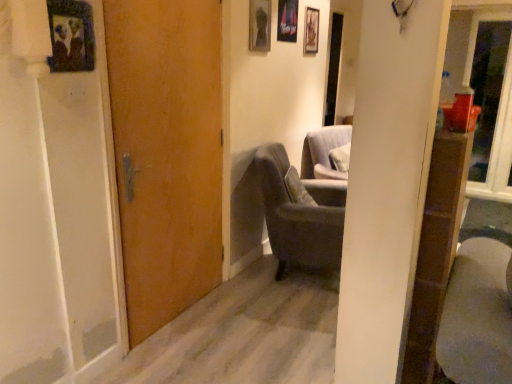
Measure the distance between metallic silver picture frame at upper center, marked as the second picture frame in a right-to-left arrangement, and camera.

The depth of metallic silver picture frame at upper center, marked as the second picture frame in a right-to-left arrangement, is 2.94 meters.

Identify the location of dark gray fabric chair at center. The width and height of the screenshot is (512, 384). (300, 215).

I want to click on transparent glass door at upper right, so click(x=490, y=107).

What is the approximate width of wooden picture frame at upper left, the 1th picture frame from the front?

1.01 inches.

What do you see at coordinates (71, 36) in the screenshot? This screenshot has width=512, height=384. I see `wooden picture frame at upper left, the first picture frame viewed from the left` at bounding box center [71, 36].

Locate an element on the screen. matte glass picture frame at upper center, placed as the 2th picture frame when sorted from front to back is located at coordinates (259, 25).

The height and width of the screenshot is (384, 512). What are the coordinates of `metallic silver picture frame at upper center, marked as the second picture frame in a right-to-left arrangement` in the screenshot? It's located at (287, 21).

In the scene shown: Is wooden picture frame at upper left, which is the 4th picture frame from back to front, wider than dark gray fabric chair at center?

No, wooden picture frame at upper left, which is the 4th picture frame from back to front, is not wider than dark gray fabric chair at center.

Is wooden picture frame at upper left, the first picture frame viewed from the left, far away from dark gray fabric chair at center?

Yes, wooden picture frame at upper left, the first picture frame viewed from the left, and dark gray fabric chair at center are quite far apart.

Which object is positioned more to the right, wooden picture frame at upper left, the fourth picture frame viewed from the right, or dark gray fabric chair at center?

dark gray fabric chair at center.

From the image's perspective, is wooden picture frame at upper left, the 1th picture frame from the front, located above or below dark gray fabric chair at center?

From the image's perspective, wooden picture frame at upper left, the 1th picture frame from the front, appears above dark gray fabric chair at center.

From the picture: Are wooden picture frame at upper center, which is the fourth picture frame from left to right, and dark gray fabric chair at center located far from each other?

Yes, wooden picture frame at upper center, which is the fourth picture frame from left to right, is far from dark gray fabric chair at center.

Considering the positions of points (314, 26) and (271, 181), is point (314, 26) closer to camera compared to point (271, 181)?

No, it is behind (271, 181).

Is wooden picture frame at upper center, the 1th picture frame viewed from the back, aimed at dark gray fabric chair at center?

No, wooden picture frame at upper center, the 1th picture frame viewed from the back, is not turned towards dark gray fabric chair at center.

From a real-world perspective, which is physically above, dark gray fabric chair at center or wooden picture frame at upper left, the 1th picture frame from the front?

From a 3D spatial view, wooden picture frame at upper left, the 1th picture frame from the front, is above.

Locate an element on the screen. The image size is (512, 384). chair lying on the right of wooden picture frame at upper left, the fourth picture frame viewed from the right is located at coordinates click(300, 215).

Which is more to the left, dark gray fabric chair at center or wooden picture frame at upper left, the first picture frame viewed from the left?

Answer: wooden picture frame at upper left, the first picture frame viewed from the left, is more to the left.

Are dark gray fabric chair at center and wooden picture frame at upper left, the first picture frame viewed from the left, far apart?

Yes, dark gray fabric chair at center is far from wooden picture frame at upper left, the first picture frame viewed from the left.

Considering the sizes of objects dark gray fabric chair at center and wooden door at center in the image provided, who is bigger, dark gray fabric chair at center or wooden door at center?

dark gray fabric chair at center is bigger.

Between dark gray fabric chair at center and wooden door at center, which one has less height?

Standing shorter between the two is dark gray fabric chair at center.

Considering the positions of objects dark gray fabric chair at center and wooden door at center in the image provided, who is more to the left, dark gray fabric chair at center or wooden door at center?

wooden door at center is more to the left.

Find the location of a particular element. Image resolution: width=512 pixels, height=384 pixels. door in front of the dark gray fabric chair at center is located at coordinates (166, 153).

Is wooden picture frame at upper left, the fourth picture frame viewed from the right, far from metallic silver picture frame at upper center, marked as the second picture frame in a right-to-left arrangement?

That's right, there is a large distance between wooden picture frame at upper left, the fourth picture frame viewed from the right, and metallic silver picture frame at upper center, marked as the second picture frame in a right-to-left arrangement.

Is point (71, 33) in front of point (278, 27)?

That is True.

Considering the relative sizes of wooden picture frame at upper left, the first picture frame viewed from the left, and metallic silver picture frame at upper center, which ranks as the third picture frame in left-to-right order, in the image provided, is wooden picture frame at upper left, the first picture frame viewed from the left, shorter than metallic silver picture frame at upper center, which ranks as the third picture frame in left-to-right order,?

Yes.

Would you say wooden picture frame at upper left, the 1th picture frame from the front, is to the left or to the right of metallic silver picture frame at upper center, positioned as the 3th picture frame in front-to-back order, in the picture?

In the image, wooden picture frame at upper left, the 1th picture frame from the front, appears on the left side of metallic silver picture frame at upper center, positioned as the 3th picture frame in front-to-back order.

Where is `picture frame that is the 2nd one when counting upward from the dark gray fabric chair at center (from the image's perspective)`? This screenshot has width=512, height=384. picture frame that is the 2nd one when counting upward from the dark gray fabric chair at center (from the image's perspective) is located at coordinates (259, 25).

Based on the photo, from the image's perspective, which one is positioned higher, dark gray fabric chair at center or matte glass picture frame at upper center, placed as the 2th picture frame when sorted from front to back?

From the image's view, matte glass picture frame at upper center, placed as the 2th picture frame when sorted from front to back, is above.

Relative to matte glass picture frame at upper center, the third picture frame from the back, is dark gray fabric chair at center in front or behind?

dark gray fabric chair at center is positioned closer to the viewer than matte glass picture frame at upper center, the third picture frame from the back.

Is dark gray fabric chair at center positioned far away from matte glass picture frame at upper center, the third picture frame from the back?

Yes.

How much distance is there between transparent glass door at upper right and wooden picture frame at upper center, the fourth picture frame when ordered from front to back?

transparent glass door at upper right and wooden picture frame at upper center, the fourth picture frame when ordered from front to back, are 2.19 meters apart.

Is wooden picture frame at upper center, which is the fourth picture frame from left to right, inside transparent glass door at upper right?

No, wooden picture frame at upper center, which is the fourth picture frame from left to right, is located outside of transparent glass door at upper right.

Locate an element on the screen. Image resolution: width=512 pixels, height=384 pixels. glass door behind the wooden picture frame at upper center, which is the fourth picture frame from left to right is located at coordinates (490, 107).

Between transparent glass door at upper right and wooden picture frame at upper center, the 1th picture frame viewed from the back, which one is positioned in front?

wooden picture frame at upper center, the 1th picture frame viewed from the back.

Where is `chair behind the wooden picture frame at upper left, the fourth picture frame viewed from the right`? The image size is (512, 384). chair behind the wooden picture frame at upper left, the fourth picture frame viewed from the right is located at coordinates (300, 215).

The height and width of the screenshot is (384, 512). Identify the location of chair on the left of wooden picture frame at upper center, the 1th picture frame viewed from the back. (300, 215).

Estimate the real-world distances between objects in this image. Which object is further from dark gray fabric chair at center, wooden picture frame at upper center, the fourth picture frame when ordered from front to back, or matte glass picture frame at upper center, which ranks as the third picture frame in right-to-left order?

wooden picture frame at upper center, the fourth picture frame when ordered from front to back, is further to dark gray fabric chair at center.

Estimate the real-world distances between objects in this image. Which object is further from wooden picture frame at upper left, the 1th picture frame from the front, dark gray fabric chair at center or wooden door at center?

The object further to wooden picture frame at upper left, the 1th picture frame from the front, is dark gray fabric chair at center.

When comparing their distances from wooden picture frame at upper left, the first picture frame viewed from the left, does wooden door at center or dark gray fabric chair at center seem closer?

wooden door at center is closer to wooden picture frame at upper left, the first picture frame viewed from the left.

From the image, which object appears to be nearer to metallic silver picture frame at upper center, which ranks as the third picture frame in left-to-right order, wooden door at center or dark gray fabric chair at center?

The object closer to metallic silver picture frame at upper center, which ranks as the third picture frame in left-to-right order, is dark gray fabric chair at center.

Which object lies nearer to the anchor point dark gray fabric chair at center, transparent glass door at upper right or wooden door at center?

Based on the image, wooden door at center appears to be nearer to dark gray fabric chair at center.

Consider the image. Considering their positions, is dark gray fabric chair at center positioned further to wooden picture frame at upper center, which is the fourth picture frame from left to right, than matte glass picture frame at upper center, the third picture frame from the back?

The object further to wooden picture frame at upper center, which is the fourth picture frame from left to right, is dark gray fabric chair at center.

From the image, which object appears to be farther from wooden picture frame at upper left, which is the 4th picture frame from back to front, transparent glass door at upper right or matte glass picture frame at upper center, placed as the 2th picture frame when sorted from front to back?

transparent glass door at upper right.

Considering their positions, is wooden picture frame at upper center, positioned as the first picture frame in right-to-left order, positioned further to transparent glass door at upper right than metallic silver picture frame at upper center, positioned as the 3th picture frame in front-to-back order?

metallic silver picture frame at upper center, positioned as the 3th picture frame in front-to-back order, is positioned further to the anchor transparent glass door at upper right.

Locate an element on the screen. chair between wooden door at center and wooden picture frame at upper center, which is the fourth picture frame from left to right, along the z-axis is located at coordinates (300, 215).

Where is `chair between wooden door at center and transparent glass door at upper right from left to right`? The image size is (512, 384). chair between wooden door at center and transparent glass door at upper right from left to right is located at coordinates (300, 215).

Where is `door between wooden picture frame at upper left, the first picture frame viewed from the left, and transparent glass door at upper right from left to right`? door between wooden picture frame at upper left, the first picture frame viewed from the left, and transparent glass door at upper right from left to right is located at coordinates (166, 153).

Identify the location of door between wooden picture frame at upper left, the fourth picture frame viewed from the right, and matte glass picture frame at upper center, placed as the 2th picture frame when sorted from front to back, in the front-back direction. (166, 153).